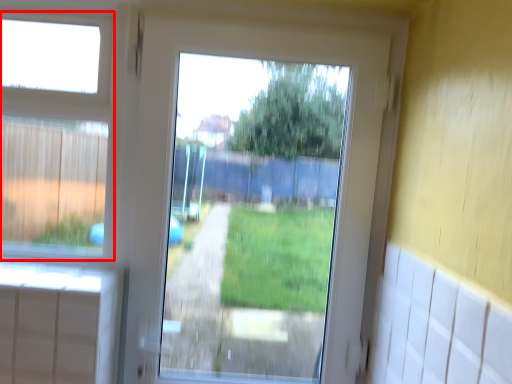
Question: From the image's perspective, considering the relative positions of bay window (annotated by the red box) and screen door in the image provided, where is bay window (annotated by the red box) located with respect to the staircase?

Choices:
 (A) above
 (B) below

Answer: (A)